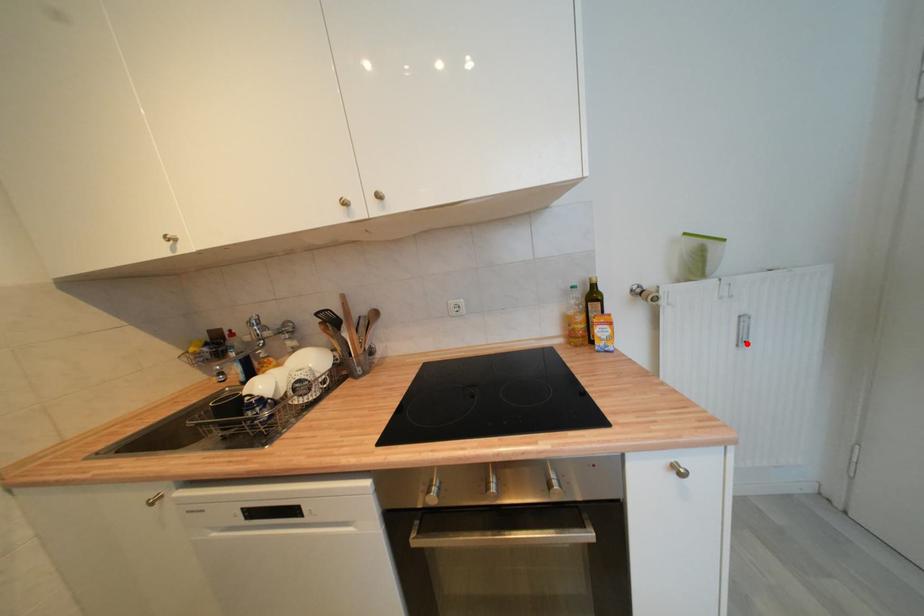
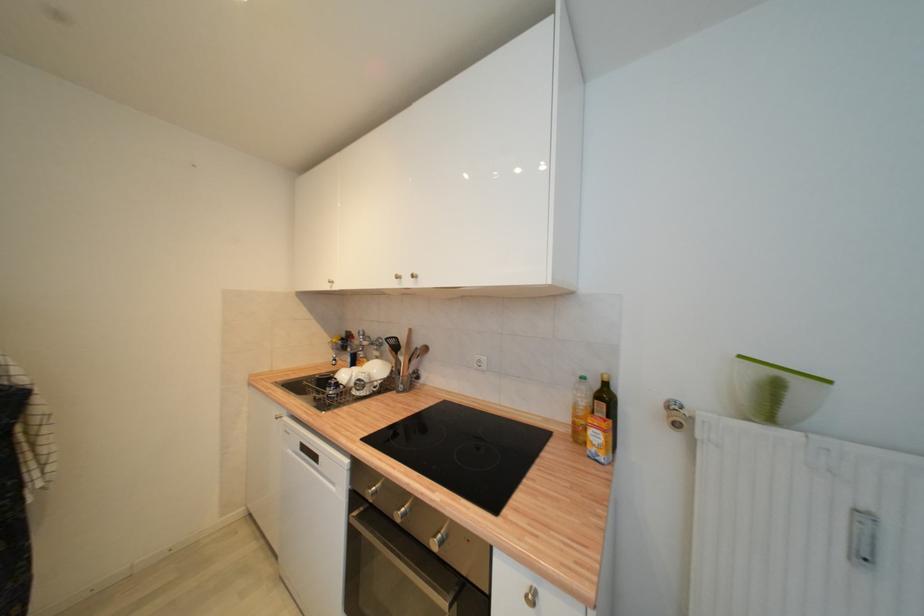
Locate, in the second image, the point that corresponds to the highlighted location in the first image.

(869, 560)